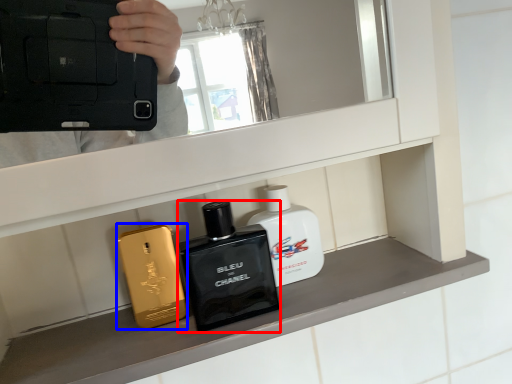
Question: Among these objects, which one is farthest to the camera, toiletry (highlighted by a red box) or perfume (highlighted by a blue box)?

Choices:
 (A) toiletry
 (B) perfume

Answer: (B)